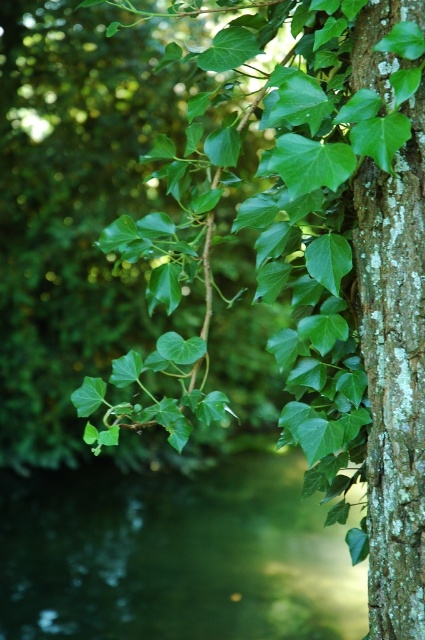
Question: Where is green liquid at lower left located in relation to green rough bark tree trunk at right in the image?

Choices:
 (A) left
 (B) right

Answer: (A)

Question: Is green liquid at lower left further to camera compared to green rough bark tree trunk at right?

Choices:
 (A) no
 (B) yes

Answer: (B)

Question: Is green liquid at lower left positioned at the back of green rough bark tree trunk at right?

Choices:
 (A) no
 (B) yes

Answer: (B)